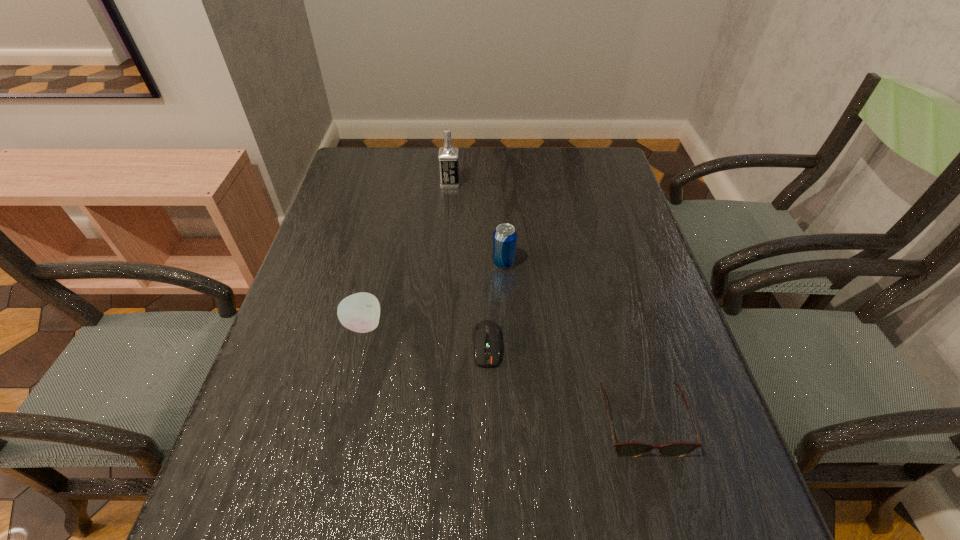
The width and height of the screenshot is (960, 540). Find the location of `vacant space situated on the front of the beer can`. vacant space situated on the front of the beer can is located at coordinates (506, 301).

At what (x,y) coordinates should I click in order to perform the action: click on vacant space located on the left of the third tallest object. Please return your answer as a coordinate pair (x, y). The width and height of the screenshot is (960, 540). Looking at the image, I should click on (303, 325).

Find the location of a particular element. The width and height of the screenshot is (960, 540). vacant space located 0.090m at the front view of the rightmost object is located at coordinates coord(665,513).

What are the coordinates of `vacant space located 0.190m on the button of the computer equipment` in the screenshot? It's located at (489, 463).

Where is `object located at the far edge`? object located at the far edge is located at coordinates (448, 155).

Where is `object that is at the left edge`? This screenshot has height=540, width=960. object that is at the left edge is located at coordinates (360, 312).

Image resolution: width=960 pixels, height=540 pixels. In order to click on object present at the right edge in this screenshot , I will do `click(627, 449)`.

You are a GUI agent. You are given a task and a screenshot of the screen. Output one action in this format:
    pyautogui.click(x=<x>, y=<y>)
    Task: Click on the vacant space at the far edge
    
    Given the screenshot: What is the action you would take?
    pyautogui.click(x=413, y=156)

Where is `vacant space at the near edge of the desktop`? This screenshot has width=960, height=540. vacant space at the near edge of the desktop is located at coordinates (365, 532).

Identify the location of vacant space at the left edge of the desktop. (340, 327).